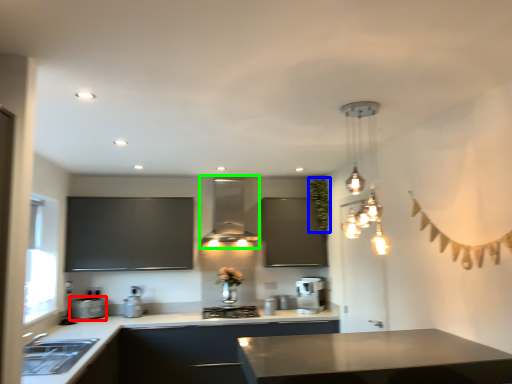
Question: Based on their relative distances, which object is nearer to appliance (highlighted by a red box)? Choose from plant (highlighted by a blue box) and exhaust hood (highlighted by a green box).

Choices:
 (A) plant
 (B) exhaust hood

Answer: (B)